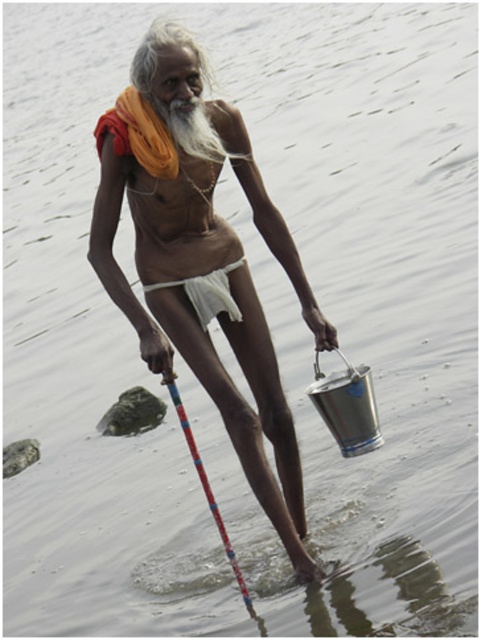
Does matte silver bucket at lower center appear under multicolored plastic fishing pole at center?

No.

Is matte silver bucket at lower center shorter than multicolored plastic fishing pole at center?

No, matte silver bucket at lower center is not shorter than multicolored plastic fishing pole at center.

Which is behind, point (251, 324) or point (167, 388)?

Point (167, 388)

Find the location of a particular element. matte silver bucket at lower center is located at coordinates (201, 259).

Is white cloth at center to the right of multicolored plastic fishing pole at center from the viewer's perspective?

In fact, white cloth at center is to the left of multicolored plastic fishing pole at center.

Identify the location of white cloth at center. (207, 292).

Locate an element on the screen. The image size is (481, 640). white cloth at center is located at coordinates (207, 292).

You are a GUI agent. You are given a task and a screenshot of the screen. Output one action in this format:
    pyautogui.click(x=<x>, y=<y>)
    Task: Click on the white cloth at center
    Image resolution: width=481 pixels, height=640 pixels.
    Given the screenshot: What is the action you would take?
    pyautogui.click(x=207, y=292)

In the scene shown: Is matte silver bucket at lower center to the left of white cloth at center from the viewer's perspective?

In fact, matte silver bucket at lower center is to the right of white cloth at center.

Consider the image. How distant is matte silver bucket at lower center from white cloth at center?

matte silver bucket at lower center is 27.74 inches from white cloth at center.

Locate an element on the screen. Image resolution: width=481 pixels, height=640 pixels. matte silver bucket at lower center is located at coordinates (201, 259).